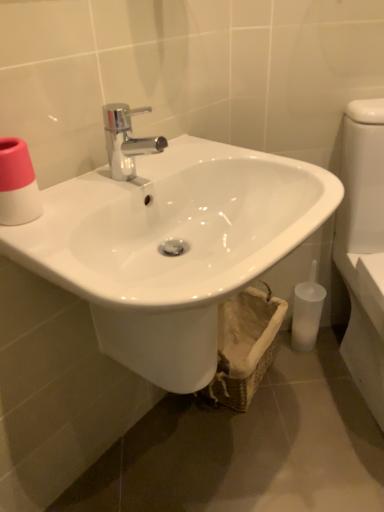
Question: From a real-world perspective, is pink matte toilet paper at upper left located beneath white glossy toilet at right?

Choices:
 (A) yes
 (B) no

Answer: (B)

Question: Is pink matte toilet paper at upper left surrounding white glossy toilet at right?

Choices:
 (A) yes
 (B) no

Answer: (B)

Question: Is pink matte toilet paper at upper left oriented towards white glossy toilet at right?

Choices:
 (A) no
 (B) yes

Answer: (A)

Question: Can you confirm if pink matte toilet paper at upper left is smaller than white glossy toilet at right?

Choices:
 (A) yes
 (B) no

Answer: (A)

Question: Is the depth of pink matte toilet paper at upper left less than that of white glossy toilet at right?

Choices:
 (A) yes
 (B) no

Answer: (A)

Question: Considering the relative positions of pink matte toilet paper at upper left and white glossy toilet at right in the image provided, is pink matte toilet paper at upper left to the right of white glossy toilet at right from the viewer's perspective?

Choices:
 (A) no
 (B) yes

Answer: (A)

Question: Considering the relative sizes of woven beige basket at lower center and translucent plastic toilet brush at lower right in the image provided, is woven beige basket at lower center thinner than translucent plastic toilet brush at lower right?

Choices:
 (A) no
 (B) yes

Answer: (A)

Question: Is woven beige basket at lower center facing towards translucent plastic toilet brush at lower right?

Choices:
 (A) no
 (B) yes

Answer: (A)

Question: From a real-world perspective, is woven beige basket at lower center positioned over translucent plastic toilet brush at lower right based on gravity?

Choices:
 (A) yes
 (B) no

Answer: (B)

Question: From a real-world perspective, is woven beige basket at lower center beneath translucent plastic toilet brush at lower right?

Choices:
 (A) yes
 (B) no

Answer: (A)

Question: Considering the relative positions of woven beige basket at lower center and translucent plastic toilet brush at lower right in the image provided, is woven beige basket at lower center in front of translucent plastic toilet brush at lower right?

Choices:
 (A) yes
 (B) no

Answer: (A)

Question: Considering the relative sizes of woven beige basket at lower center and translucent plastic toilet brush at lower right in the image provided, is woven beige basket at lower center wider than translucent plastic toilet brush at lower right?

Choices:
 (A) yes
 (B) no

Answer: (A)

Question: Can you confirm if pink matte toilet paper at upper left is taller than translucent plastic toilet brush at lower right?

Choices:
 (A) no
 (B) yes

Answer: (A)